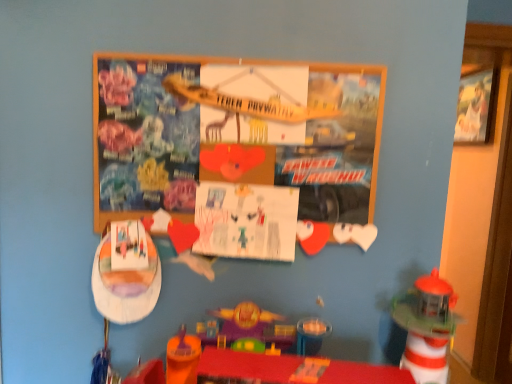
Question: In the image, is wooden boat at lower left, the 2th toy from the right, on the left side or the right side of translucent plastic lighthouse at lower right, the 2th toy positioned from the left?

Choices:
 (A) left
 (B) right

Answer: (A)

Question: Does point (124, 284) appear closer or farther from the camera than point (445, 319)?

Choices:
 (A) closer
 (B) farther

Answer: (B)

Question: Based on their relative distances, which object is nearer to the wooden bulletin board at center?

Choices:
 (A) wooden picture frame at upper right
 (B) translucent plastic lighthouse at lower right, the 2th toy positioned from the left
 (C) wooden boat at lower left, the 2th toy from the right
 (D) white paper at center

Answer: (D)

Question: Estimate the real-world distances between objects in this image. Which object is farther from the wooden boat at lower left, the 2th toy from the right?

Choices:
 (A) wooden bulletin board at center
 (B) white paper at center
 (C) wooden picture frame at upper right
 (D) translucent plastic lighthouse at lower right, placed as the 1th toy when sorted from right to left

Answer: (C)